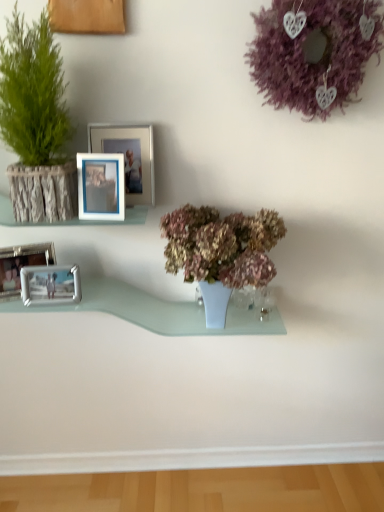
This screenshot has height=512, width=384. What do you see at coordinates (129, 156) in the screenshot?
I see `blue plastic picture frame at upper center, the 1th picture frame positioned from the right` at bounding box center [129, 156].

Where is `metallic silver picture frame at lower left, which is the fourth picture frame from right to left`? Image resolution: width=384 pixels, height=512 pixels. metallic silver picture frame at lower left, which is the fourth picture frame from right to left is located at coordinates (21, 265).

Describe the element at coordinates (221, 246) in the screenshot. I see `dry matte flowers at center, the second houseplant when ordered from left to right` at that location.

You are a GUI agent. You are given a task and a screenshot of the screen. Output one action in this format:
    pyautogui.click(x=<x>, y=<y>)
    Task: Click on the green textured plant at left, which is counted as the 2th houseplant, starting from the right
    
    Given the screenshot: What is the action you would take?
    pyautogui.click(x=36, y=123)

Is green textured plant at left, the first houseplant when ordered from left to right, positioned beyond the bounds of wooden frame at left?

Indeed, green textured plant at left, the first houseplant when ordered from left to right, is completely outside wooden frame at left.

From a real-world perspective, does green textured plant at left, which is counted as the 2th houseplant, starting from the right, sit lower than wooden frame at left?

Incorrect, from a real-world perspective, green textured plant at left, which is counted as the 2th houseplant, starting from the right, is higher than wooden frame at left.

Looking at the image, does green textured plant at left, the first houseplant when ordered from top to bottom, seem bigger or smaller compared to wooden frame at left?

Considering their sizes, green textured plant at left, the first houseplant when ordered from top to bottom, takes up more space than wooden frame at left.

What's the angular difference between green textured plant at left, the first houseplant when ordered from top to bottom, and wooden frame at left's facing directions?

The angular difference between green textured plant at left, the first houseplant when ordered from top to bottom, and wooden frame at left is 0.369 degrees.

Considering the positions of points (182, 225) and (262, 80), is point (182, 225) closer to camera compared to point (262, 80)?

Yes.

Which of these two, dry matte flowers at center, positioned as the 1th houseplant in bottom-to-top order, or purple matte wreath at upper right, is bigger?

dry matte flowers at center, positioned as the 1th houseplant in bottom-to-top order, is bigger.

Consider the image. Looking at their sizes, would you say dry matte flowers at center, which appears as the 2th houseplant when viewed from the top, is wider or thinner than purple matte wreath at upper right?

Considering their sizes, dry matte flowers at center, which appears as the 2th houseplant when viewed from the top, looks broader than purple matte wreath at upper right.

Is dry matte flowers at center, which appears as the 2th houseplant when viewed from the top, not inside purple matte wreath at upper right?

Absolutely, dry matte flowers at center, which appears as the 2th houseplant when viewed from the top, is external to purple matte wreath at upper right.

Is clear glass shelf at center closer to the viewer compared to wooden frame at left?

No, it is not.

Is clear glass shelf at center not within wooden frame at left?

Yes, clear glass shelf at center is located beyond the bounds of wooden frame at left.

Are clear glass shelf at center and wooden frame at left beside each other?

No, clear glass shelf at center is not in contact with wooden frame at left.

Which point is more distant from viewer, (31,309) or (57,223)?

Positioned behind is point (57,223).

Looking at this image, from a real-world perspective, is wooden frame at left physically above purple matte wreath at upper right?

No, from a real-world perspective, wooden frame at left is not on top of purple matte wreath at upper right.

Which is closer, (128, 209) or (300, 34)?

Point (128, 209) is positioned farther from the camera compared to point (300, 34).

Considering the sizes of wooden frame at left and purple matte wreath at upper right in the image, is wooden frame at left taller or shorter than purple matte wreath at upper right?

wooden frame at left is shorter than purple matte wreath at upper right.

Are wooden frame at left and purple matte wreath at upper right making contact?

No.

Is blue plastic picture frame at upper center, the 1th picture frame positioned from the right, aimed at green textured plant at left, acting as the second houseplant starting from the bottom?

No, blue plastic picture frame at upper center, the 1th picture frame positioned from the right, is not oriented towards green textured plant at left, acting as the second houseplant starting from the bottom.

Are blue plastic picture frame at upper center, acting as the 4th picture frame starting from the left, and green textured plant at left, the first houseplant when ordered from top to bottom, making contact?

No, blue plastic picture frame at upper center, acting as the 4th picture frame starting from the left, is not beside green textured plant at left, the first houseplant when ordered from top to bottom.

Does point (128, 166) come farther from viewer compared to point (63, 162)?

That is False.

Would you say green textured plant at left, acting as the second houseplant starting from the bottom, is part of blue plastic picture frame at upper center, acting as the 4th picture frame starting from the left,'s contents?

That's incorrect, green textured plant at left, acting as the second houseplant starting from the bottom, is not inside blue plastic picture frame at upper center, acting as the 4th picture frame starting from the left.

In order to click on window sill below the blue plastic picture frame at upper center, the 1th picture frame positioned from the right (from a real-world perspective) in this screenshot , I will do `click(161, 311)`.

Would you consider blue plastic picture frame at upper center, acting as the 4th picture frame starting from the left, to be distant from clear glass shelf at center?

No, blue plastic picture frame at upper center, acting as the 4th picture frame starting from the left, is not far from clear glass shelf at center.

Is blue plastic picture frame at upper center, the 1th picture frame positioned from the right, completely or partially outside of clear glass shelf at center?

Yes, blue plastic picture frame at upper center, the 1th picture frame positioned from the right, is located beyond the bounds of clear glass shelf at center.

From a real-world perspective, is blue plastic picture frame at upper center, the 1th picture frame positioned from the right, positioned under clear glass shelf at center based on gravity?

Incorrect, from a real-world perspective, blue plastic picture frame at upper center, the 1th picture frame positioned from the right, is higher than clear glass shelf at center.

Considering the sizes of clear glass shelf at center and white plastic picture frame at upper center, which is counted as the second picture frame, starting from the right, in the image, is clear glass shelf at center wider or thinner than white plastic picture frame at upper center, which is counted as the second picture frame, starting from the right,?

Considering their sizes, clear glass shelf at center looks broader than white plastic picture frame at upper center, which is counted as the second picture frame, starting from the right.

Can you tell me how much clear glass shelf at center and white plastic picture frame at upper center, which is counted as the second picture frame, starting from the right, differ in facing direction?

The facing directions of clear glass shelf at center and white plastic picture frame at upper center, which is counted as the second picture frame, starting from the right, are 8.66 degrees apart.

In the scene shown: Measure the distance between clear glass shelf at center and white plastic picture frame at upper center, which is counted as the second picture frame, starting from the right.

clear glass shelf at center and white plastic picture frame at upper center, which is counted as the second picture frame, starting from the right, are 16.79 inches apart.

Is clear glass shelf at center looking in the opposite direction of white plastic picture frame at upper center, which is counted as the second picture frame, starting from the right?

clear glass shelf at center is not turned away from white plastic picture frame at upper center, which is counted as the second picture frame, starting from the right.

I want to click on houseplant located above the wooden frame at left (from a real-world perspective), so click(36, 123).

The height and width of the screenshot is (512, 384). Identify the location of the 2nd houseplant below when counting from the purple matte wreath at upper right (from the image's perspective). (221, 246).

When comparing their distances from dry matte flowers at center, positioned as the 1th houseplant in bottom-to-top order, does metallic silver picture frame at lower left, which is counted as the first picture frame, starting from the left, or wooden frame at left seem further?

Among the two, metallic silver picture frame at lower left, which is counted as the first picture frame, starting from the left, is located further to dry matte flowers at center, positioned as the 1th houseplant in bottom-to-top order.

From the picture: When comparing their distances from metallic silver picture frame at left, the 3th picture frame viewed from the right, does metallic silver picture frame at lower left, which is counted as the first picture frame, starting from the left, or wooden frame at left seem closer?

Based on the image, metallic silver picture frame at lower left, which is counted as the first picture frame, starting from the left, appears to be nearer to metallic silver picture frame at left, the 3th picture frame viewed from the right.

When comparing their distances from metallic silver picture frame at lower left, which is the fourth picture frame from right to left, does dry matte flowers at center, which ranks as the 1th houseplant in right-to-left order, or white plastic picture frame at upper center, which is counted as the second picture frame, starting from the right, seem further?

dry matte flowers at center, which ranks as the 1th houseplant in right-to-left order, is further to metallic silver picture frame at lower left, which is the fourth picture frame from right to left.

Consider the image. Based on their spatial positions, is purple matte wreath at upper right or green textured plant at left, acting as the second houseplant starting from the bottom, further from metallic silver picture frame at left, the second picture frame when ordered from left to right?

Based on the image, purple matte wreath at upper right appears to be further to metallic silver picture frame at left, the second picture frame when ordered from left to right.

Estimate the real-world distances between objects in this image. Which object is further from metallic silver picture frame at lower left, which is the fourth picture frame from right to left, purple matte wreath at upper right or green textured plant at left, which is counted as the 2th houseplant, starting from the right?

Among the two, purple matte wreath at upper right is located further to metallic silver picture frame at lower left, which is the fourth picture frame from right to left.

Which object lies further to the anchor point metallic silver picture frame at left, the 3th picture frame viewed from the right, blue plastic picture frame at upper center, acting as the 4th picture frame starting from the left, or green textured plant at left, which is counted as the 2th houseplant, starting from the right?

green textured plant at left, which is counted as the 2th houseplant, starting from the right.

Considering their positions, is wooden frame at left positioned closer to dry matte flowers at center, which appears as the 2th houseplant when viewed from the top, than metallic silver picture frame at left, the 3th picture frame viewed from the right?

wooden frame at left.

Looking at the image, which one is located closer to metallic silver picture frame at lower left, which is counted as the first picture frame, starting from the left, blue plastic picture frame at upper center, acting as the 4th picture frame starting from the left, or metallic silver picture frame at left, the second picture frame when ordered from left to right?

metallic silver picture frame at left, the second picture frame when ordered from left to right, is closer to metallic silver picture frame at lower left, which is counted as the first picture frame, starting from the left.

Locate an element on the screen. This screenshot has height=512, width=384. picture frame located between green textured plant at left, the first houseplant when ordered from top to bottom, and wooden frame at left in the depth direction is located at coordinates (101, 186).

The width and height of the screenshot is (384, 512). What are the coordinates of `picture frame between wooden frame at left and blue plastic picture frame at upper center, the 1th picture frame positioned from the right` in the screenshot? It's located at (101, 186).

This screenshot has width=384, height=512. What are the coordinates of `shelf between green textured plant at left, which is counted as the 2th houseplant, starting from the right, and dry matte flowers at center, which ranks as the 1th houseplant in right-to-left order, from left to right` in the screenshot? It's located at (71, 219).

In order to click on window sill between green textured plant at left, acting as the second houseplant starting from the bottom, and purple matte wreath at upper right in this screenshot , I will do `click(161, 311)`.